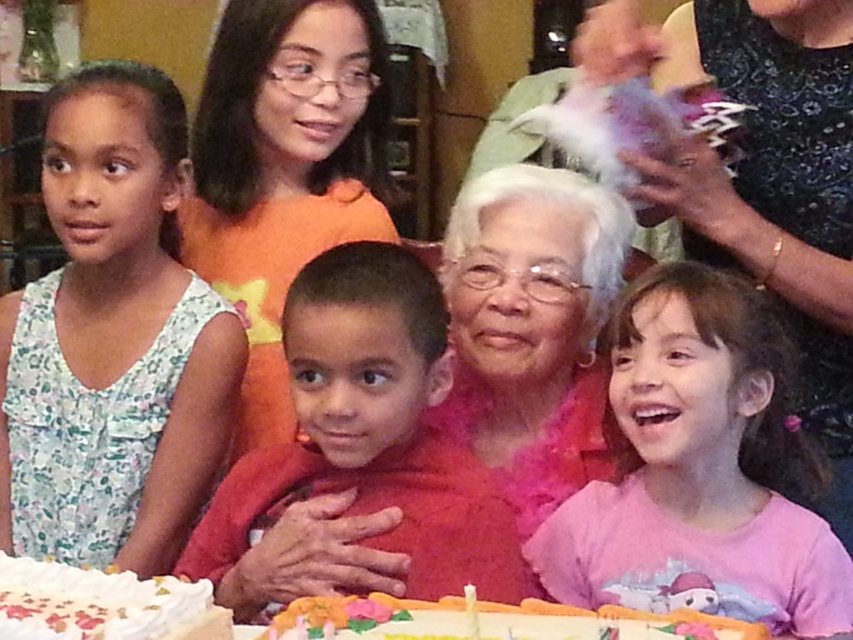
You are a photographer trying to capture a closeup of the white frosted cake with colorful decorations at lower center. However, the matte orange blouse at center is blocking your view. Can you estimate if the blouse is narrow enough to move aside without affecting the cake?

The matte orange blouse at center is thinner than the white frosted cake with colorful decorations at lower center, so it is likely narrow enough to move aside without affecting the cake.

You are a guest at the birthday party and want to take a photo of both the white frosted cake at lower left and the white frosted cake with colorful decorations at lower center. Which cake should you position closer to the camera to include both in the frame without moving them?

You should position the white frosted cake at lower left closer to the camera since it is already to the left of the white frosted cake with colorful decorations at lower center, so moving the left one forward would help both fit in the frame.